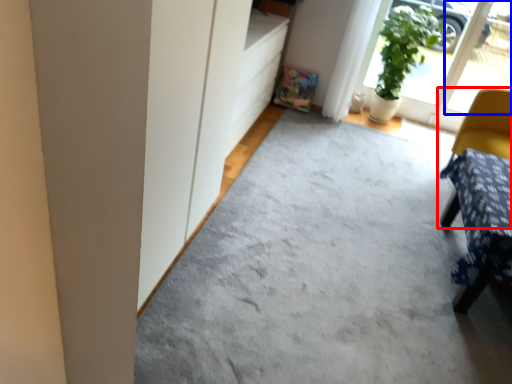
Question: Which object appears farthest to the camera in this image, chair (highlighted by a red box) or window (highlighted by a blue box)?

Choices:
 (A) chair
 (B) window

Answer: (B)